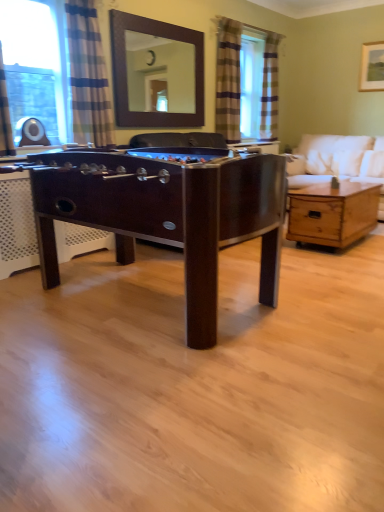
At what (x,y) coordinates should I click in order to perform the action: click on vacant space in front of wooden coffee table at center. Please return your answer as a coordinate pair (x, y). The image size is (384, 512). Looking at the image, I should click on (350, 266).